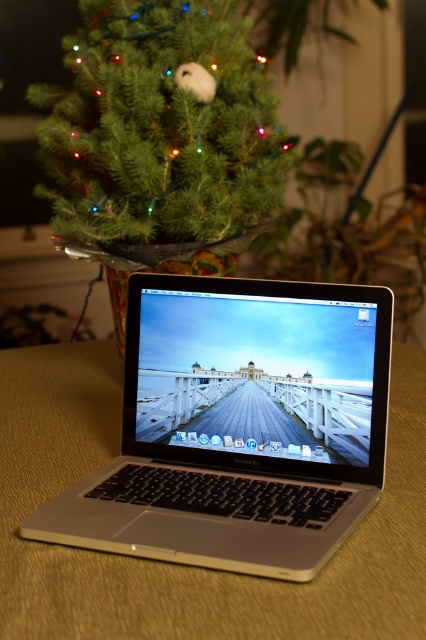
Can you confirm if silver metallic laptop at center is positioned above green matte christmas tree at upper left?

No.

Is point (152, 355) closer to viewer compared to point (106, 65)?

Yes, it is.

What are the coordinates of `silver metallic laptop at center` in the screenshot? It's located at (238, 426).